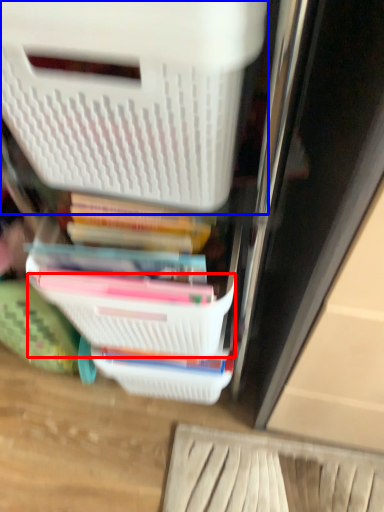
Question: Among these objects, which one is nearest to the camera, basket (highlighted by a red box) or storage box (highlighted by a blue box)?

Choices:
 (A) basket
 (B) storage box

Answer: (B)